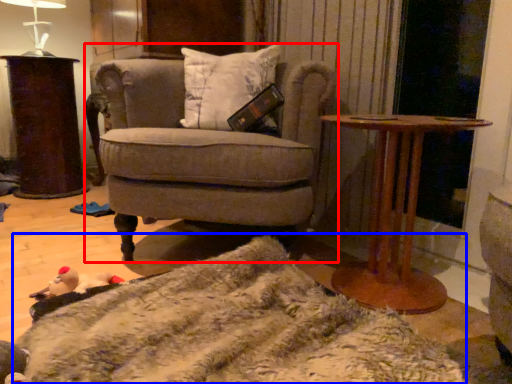
Question: Which point is further to the camera, chair (highlighted by a red box) or blanket (highlighted by a blue box)?

Choices:
 (A) chair
 (B) blanket

Answer: (A)